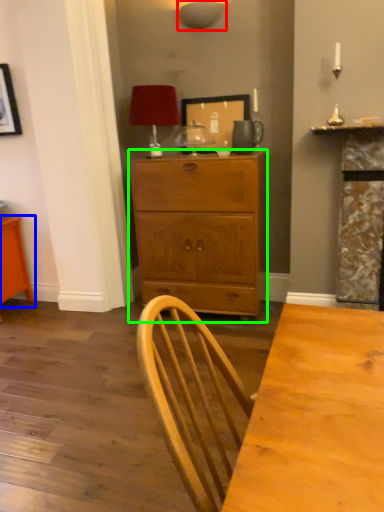
Question: Which object is the farthest from lamp (highlighted by a red box)? Choose among these: vanity (highlighted by a blue box) or chest of drawers (highlighted by a green box).

Choices:
 (A) vanity
 (B) chest of drawers

Answer: (A)